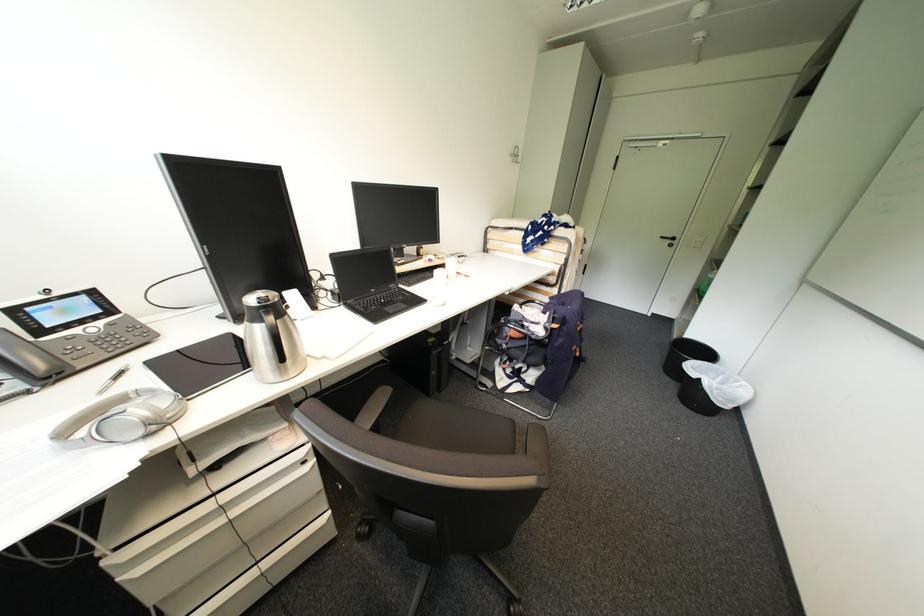
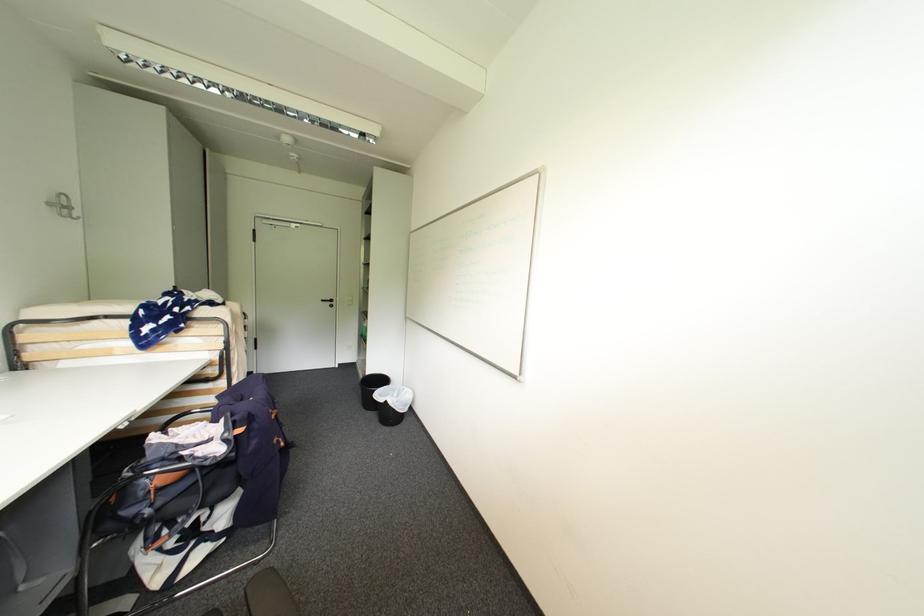
Question: The camera is either moving clockwise (left) or counter-clockwise (right) around the object. The first image is from the beginning of the video and the second image is from the end. Is the camera moving left or right when shooting the video?

Choices:
 (A) Left
 (B) Right

Answer: (A)